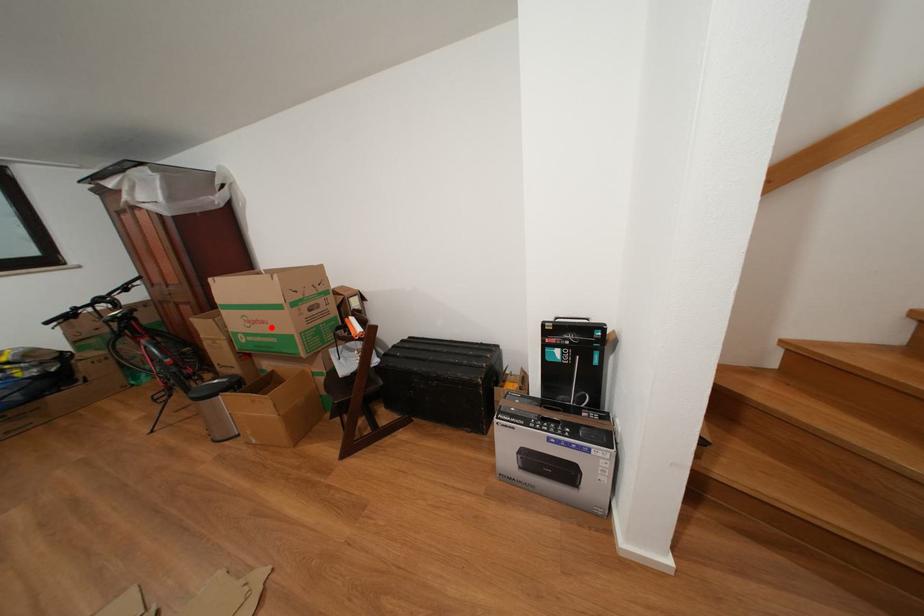
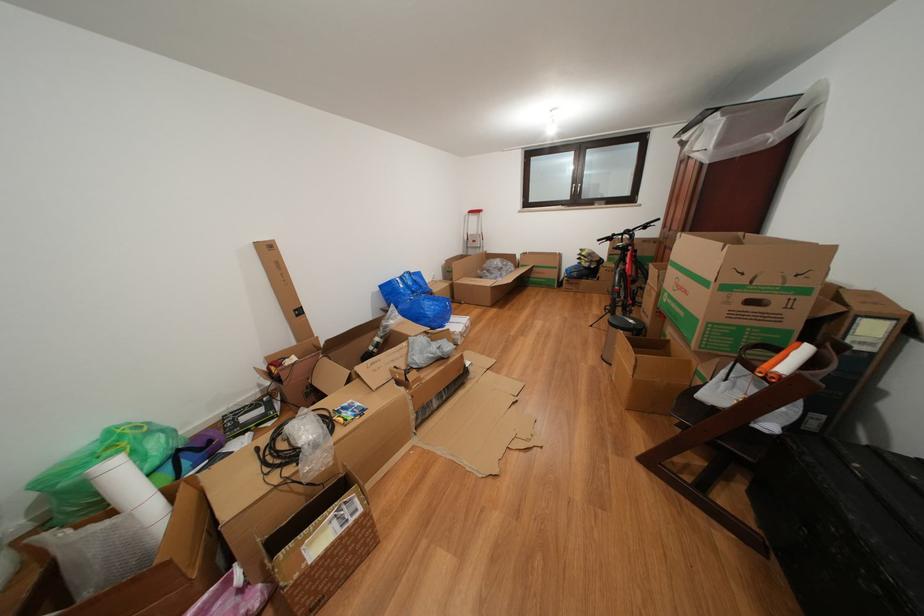
Question: I am providing you with two images of the same scene from different viewpoints. Image1 has a red point marked. In image2, the corresponding 3D location appears at what relative position? Reply with the corresponding letter.

Choices:
 (A) Closer
 (B) Farther

Answer: (A)